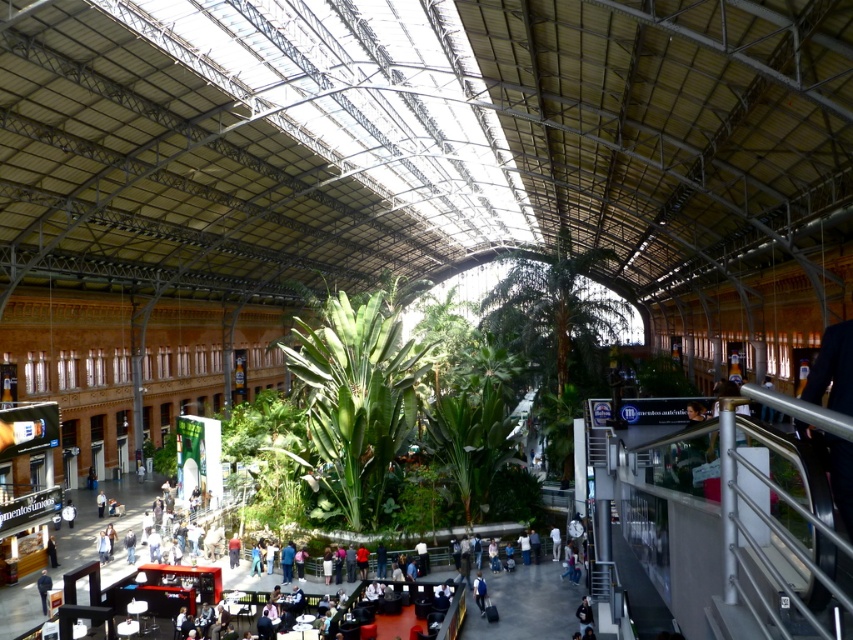
Is dark gray jacket at center closer to the viewer compared to white fabric jacket at center?

That is True.

Between dark gray jacket at center and white fabric jacket at center, which one is positioned lower?

Positioned lower is white fabric jacket at center.

Where is `dark gray jacket at center`? This screenshot has height=640, width=853. dark gray jacket at center is located at coordinates (584, 614).

Where is `dark gray jacket at center`? dark gray jacket at center is located at coordinates (584, 614).

Can you confirm if blue fabric jacket at center is thinner than white fabric jacket at center?

Incorrect, blue fabric jacket at center's width is not less than white fabric jacket at center's.

Is blue fabric jacket at center taller than white fabric jacket at center?

In fact, blue fabric jacket at center may be shorter than white fabric jacket at center.

Who is more distant from viewer, (x=476, y=576) or (x=558, y=557)?

The point (x=558, y=557) is behind.

Where is `blue fabric jacket at center`? This screenshot has width=853, height=640. blue fabric jacket at center is located at coordinates (479, 592).

Based on the photo, who is higher up, blue fabric jacket at center or dark blue jacket at center?

Positioned higher is blue fabric jacket at center.

This screenshot has width=853, height=640. What do you see at coordinates (479, 592) in the screenshot? I see `blue fabric jacket at center` at bounding box center [479, 592].

At what (x,y) coordinates should I click in order to perform the action: click on blue fabric jacket at center. Please return your answer as a coordinate pair (x, y). Looking at the image, I should click on (479, 592).